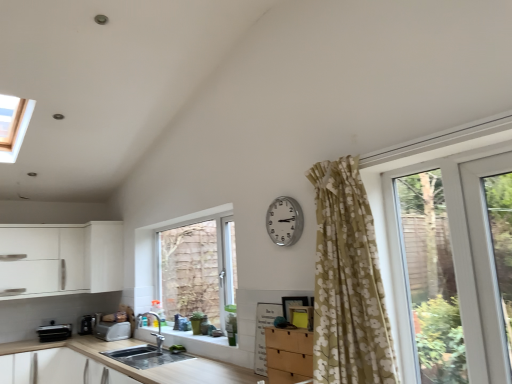
How much space does black plastic toaster at lower left, which appears as the third appliance when viewed from the right, occupy horizontally?

The width of black plastic toaster at lower left, which appears as the third appliance when viewed from the right, is 17.45 inches.

You are a GUI agent. You are given a task and a screenshot of the screen. Output one action in this format:
    pyautogui.click(x=<x>, y=<y>)
    Task: Click on the smooth concrete sink at lower center
    The image size is (512, 384).
    Given the screenshot: What is the action you would take?
    pyautogui.click(x=195, y=336)

Measure the distance between point (x=470, y=185) and camera.

The distance of point (x=470, y=185) from camera is 2.00 meters.

The height and width of the screenshot is (384, 512). What do you see at coordinates (104, 256) in the screenshot?
I see `white matte cabinet at left` at bounding box center [104, 256].

The image size is (512, 384). What do you see at coordinates (284, 221) in the screenshot? I see `silver metallic clock at upper center` at bounding box center [284, 221].

Locate an element on the screen. wooden at lower left is located at coordinates (141, 370).

Identify the location of black plastic toaster at lower left, which appears as the third appliance when viewed from the right. The width and height of the screenshot is (512, 384). (54, 332).

Which object is further away from the camera taking this photo, wooden at lower left or white matte cabinet at left?

white matte cabinet at left.

In the scene shown: How many degrees apart are the facing directions of wooden at lower left and white matte cabinet at left?

The angle between the facing direction of wooden at lower left and the facing direction of white matte cabinet at left is 90.1 degrees.

Where is `cabinetry that appears on the left of wooden at lower left`? The image size is (512, 384). cabinetry that appears on the left of wooden at lower left is located at coordinates (104, 256).

Based on the photo, from their relative heights in the image, would you say wooden at lower left is taller or shorter than white matte cabinet at left?

Considering their sizes, wooden at lower left has less height than white matte cabinet at left.

Is white plastic screen door at right to the left or to the right of white plastic toaster at lower left, acting as the 3th appliance starting from the left, in the image?

Clearly, white plastic screen door at right is on the right of white plastic toaster at lower left, acting as the 3th appliance starting from the left, in the image.

From the image's perspective, is white plastic screen door at right located above white plastic toaster at lower left, the first appliance in the right-to-left sequence?

Indeed, from the image's perspective, white plastic screen door at right is shown above white plastic toaster at lower left, the first appliance in the right-to-left sequence.

Considering the relative sizes of white plastic screen door at right and white plastic toaster at lower left, acting as the 3th appliance starting from the left, in the image provided, is white plastic screen door at right smaller than white plastic toaster at lower left, acting as the 3th appliance starting from the left,?

Yes.

Considering the relative sizes of white plastic screen door at right and white plastic toaster at lower left, the first appliance in the right-to-left sequence, in the image provided, is white plastic screen door at right taller than white plastic toaster at lower left, the first appliance in the right-to-left sequence,?

Indeed, white plastic screen door at right has a greater height compared to white plastic toaster at lower left, the first appliance in the right-to-left sequence.

Which is behind, point (86, 322) or point (60, 341)?

Point (86, 322)

What are the coordinates of `the 3rd appliance directly above the wooden at lower left (from a real-world perspective)` in the screenshot? It's located at (89, 323).

Is metallic silver toaster at lower left, the second appliance viewed from the left, shorter than wooden at lower left?

Indeed, metallic silver toaster at lower left, the second appliance viewed from the left, has a lesser height compared to wooden at lower left.

From a real-world perspective, who is located lower, metallic silver toaster at lower left, the second appliance viewed from the left, or wooden at lower left?

wooden at lower left.

Considering the positions of objects white plastic screen door at right and silver metallic clock at upper center in the image provided, who is in front, white plastic screen door at right or silver metallic clock at upper center?

white plastic screen door at right is in front.

Can you confirm if white plastic screen door at right is smaller than silver metallic clock at upper center?

No.

Which is farther from the camera, (x=506, y=373) or (x=292, y=210)?

The point (x=292, y=210) is farther from the camera.

From a real-world perspective, between white plastic screen door at right and silver metallic clock at upper center, who is vertically lower?

white plastic screen door at right.

Can you confirm if silver metallic clock at upper center is bigger than white plastic screen door at right?

Incorrect, silver metallic clock at upper center is not larger than white plastic screen door at right.

Is the depth of silver metallic clock at upper center less than that of white plastic screen door at right?

No, it is not.

Is point (296, 216) behind point (464, 188)?

Yes.

Which is correct: black plastic toaster at lower left, positioned as the 1th appliance in left-to-right order, is inside white plastic toaster at lower left, the first appliance in the right-to-left sequence, or outside of it?

The correct answer is: outside.

Identify the location of the 2nd appliance to the left of the white plastic toaster at lower left, acting as the 3th appliance starting from the left, counting from the anchor's position. The image size is (512, 384). (54, 332).

Which is farther from the camera, (67, 338) or (108, 323)?

The point (67, 338) is behind.

From the image's perspective, between black plastic toaster at lower left, positioned as the 1th appliance in left-to-right order, and smooth concrete sink at lower center, who is located below?

black plastic toaster at lower left, positioned as the 1th appliance in left-to-right order.

Is smooth concrete sink at lower center at the back of black plastic toaster at lower left, positioned as the 1th appliance in left-to-right order?

No, black plastic toaster at lower left, positioned as the 1th appliance in left-to-right order, is not facing away from smooth concrete sink at lower center.

Are black plastic toaster at lower left, positioned as the 1th appliance in left-to-right order, and smooth concrete sink at lower center located far from each other?

black plastic toaster at lower left, positioned as the 1th appliance in left-to-right order, is far away from smooth concrete sink at lower center.

Locate an element on the screen. The width and height of the screenshot is (512, 384). countertop below the white matte cabinet at left (from the image's perspective) is located at coordinates (141, 370).

Identify the location of screen door on the right of the white plastic toaster at lower left, acting as the 3th appliance starting from the left. The image size is (512, 384). (485, 270).

When comparing their distances from white matte cabinet at left, does white plastic toaster at lower left, the first appliance in the right-to-left sequence, or black plastic toaster at lower left, positioned as the 1th appliance in left-to-right order, seem further?

black plastic toaster at lower left, positioned as the 1th appliance in left-to-right order, is further to white matte cabinet at left.

Which object lies further to the anchor point white plastic toaster at lower left, the first appliance in the right-to-left sequence, black plastic toaster at lower left, positioned as the 1th appliance in left-to-right order, or metallic silver toaster at lower left, the second appliance viewed from the left?

Among the two, black plastic toaster at lower left, positioned as the 1th appliance in left-to-right order, is located further to white plastic toaster at lower left, the first appliance in the right-to-left sequence.

Looking at the image, which one is located closer to metallic silver toaster at lower left, the second appliance viewed from the left, black plastic toaster at lower left, positioned as the 1th appliance in left-to-right order, or white plastic toaster at lower left, acting as the 3th appliance starting from the left?

Based on the image, white plastic toaster at lower left, acting as the 3th appliance starting from the left, appears to be nearer to metallic silver toaster at lower left, the second appliance viewed from the left.

Based on their spatial positions, is white matte cabinet at left or smooth concrete sink at lower center closer to white plastic screen door at right?

Based on the image, smooth concrete sink at lower center appears to be nearer to white plastic screen door at right.

When comparing their distances from wooden at lower left, does metallic silver toaster at lower left, the second appliance viewed from the left, or white plastic toaster at lower left, the first appliance in the right-to-left sequence, seem closer?

white plastic toaster at lower left, the first appliance in the right-to-left sequence, is closer to wooden at lower left.

From the image, which object appears to be farther from metallic silver toaster at lower left, the second appliance viewed from the left, white plastic screen door at right or wooden at lower left?

white plastic screen door at right.

Based on their spatial positions, is white matte cabinet at left or silver metallic clock at upper center closer to white plastic screen door at right?

Based on the image, silver metallic clock at upper center appears to be nearer to white plastic screen door at right.

Looking at the image, which one is located further to silver metallic clock at upper center, white plastic toaster at lower left, the first appliance in the right-to-left sequence, or metallic silver toaster at lower left, acting as the 2th appliance starting from the right?

metallic silver toaster at lower left, acting as the 2th appliance starting from the right.

You are a GUI agent. You are given a task and a screenshot of the screen. Output one action in this format:
    pyautogui.click(x=<x>, y=<y>)
    Task: Click on the window sill between white plastic screen door at right and metallic silver toaster at lower left, the second appliance viewed from the left, along the z-axis
    
    Given the screenshot: What is the action you would take?
    pyautogui.click(x=195, y=336)

Locate an element on the screen. window sill between wooden at lower left and white plastic toaster at lower left, acting as the 3th appliance starting from the left, from front to back is located at coordinates (195, 336).

Find the location of a particular element. This screenshot has width=512, height=384. cabinetry located between smooth concrete sink at lower center and metallic silver toaster at lower left, the second appliance viewed from the left, in the depth direction is located at coordinates (x=104, y=256).

Find the location of a particular element. window sill between wooden at lower left and metallic silver toaster at lower left, the second appliance viewed from the left, from front to back is located at coordinates tap(195, 336).